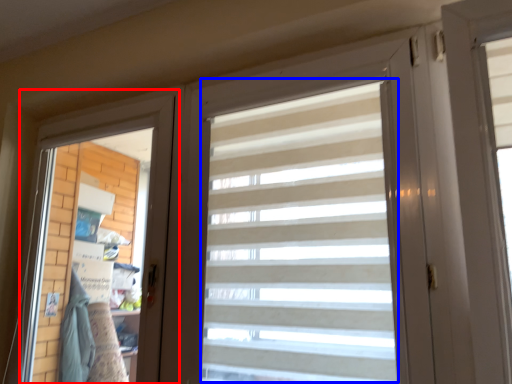
Question: Which object is further to the camera taking this photo, screen door (highlighted by a red box) or curtain (highlighted by a blue box)?

Choices:
 (A) screen door
 (B) curtain

Answer: (A)